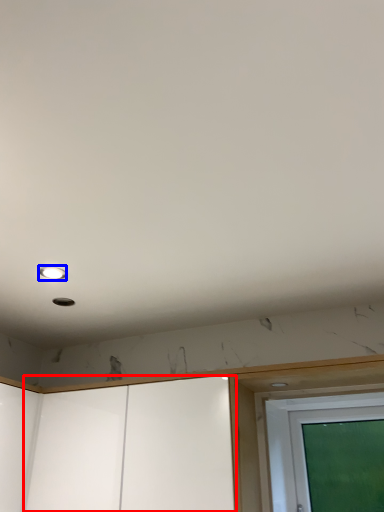
Question: Which of the following is the farthest to the observer, screen door (highlighted by a red box) or droplight (highlighted by a blue box)?

Choices:
 (A) screen door
 (B) droplight

Answer: (B)